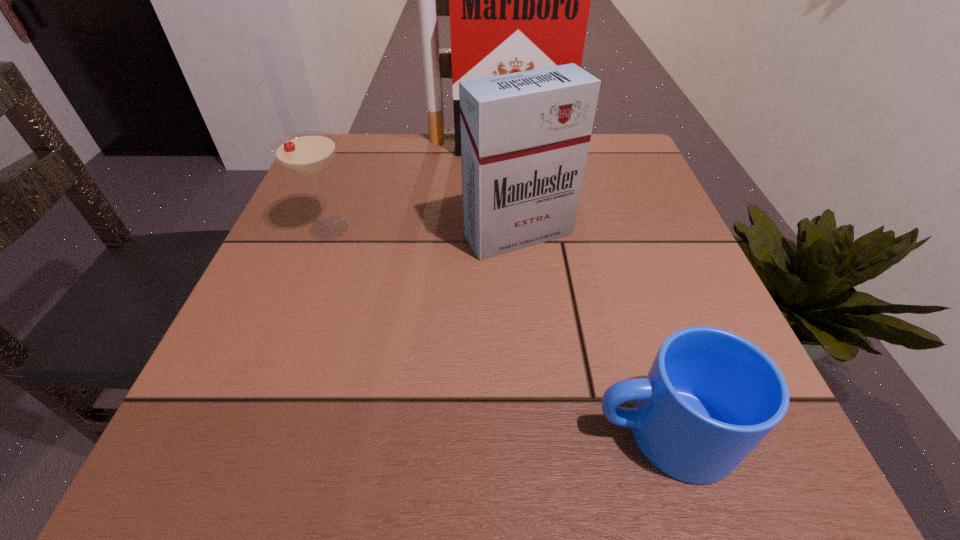
Locate an element on the screen. free spot located 0.260m on the right of the leftmost object is located at coordinates (495, 228).

Image resolution: width=960 pixels, height=540 pixels. I want to click on vacant region located on the side of the mug with the handle, so click(x=280, y=432).

This screenshot has height=540, width=960. Find the location of `free space located 0.270m on the side of the mug with the handle`. free space located 0.270m on the side of the mug with the handle is located at coordinates 376,432.

This screenshot has width=960, height=540. What are the coordinates of `vacant point located on the side of the mug with the handle` in the screenshot? It's located at (337, 432).

What are the coordinates of `object at the far edge` in the screenshot? It's located at [519, 0].

In order to click on object that is at the near edge in this screenshot , I will do `click(711, 396)`.

Image resolution: width=960 pixels, height=540 pixels. Find the location of `object present at the left edge`. object present at the left edge is located at coordinates (308, 153).

Locate an element on the screen. Image resolution: width=960 pixels, height=540 pixels. object present at the right edge is located at coordinates (711, 396).

Locate an element on the screen. This screenshot has width=960, height=540. object located at the near right corner is located at coordinates (711, 396).

In order to click on free space at the far edge of the desktop in this screenshot , I will do `click(394, 184)`.